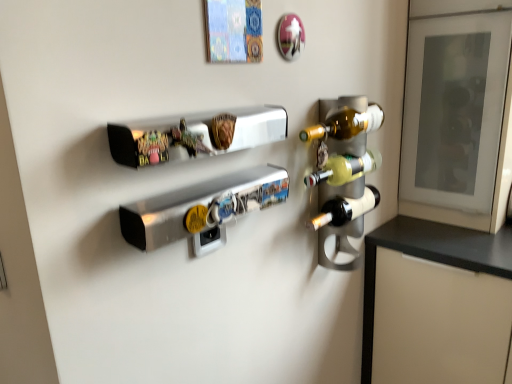
Question: Does brushed metal snowboard at center contain matte black wine bottle at right, placed as the 1th bottle when sorted from bottom to top?

Choices:
 (A) no
 (B) yes

Answer: (A)

Question: Is brushed metal snowboard at center at the left side of matte black wine bottle at right, marked as the 2th bottle in a top-to-bottom arrangement?

Choices:
 (A) yes
 (B) no

Answer: (A)

Question: Is matte black wine bottle at right, placed as the 1th bottle when sorted from bottom to top, at the back of brushed metal snowboard at center?

Choices:
 (A) no
 (B) yes

Answer: (A)

Question: Is brushed metal snowboard at center in front of matte black wine bottle at right, placed as the 1th bottle when sorted from bottom to top?

Choices:
 (A) no
 (B) yes

Answer: (B)

Question: From a real-world perspective, is brushed metal snowboard at center physically below matte black wine bottle at right, placed as the 1th bottle when sorted from bottom to top?

Choices:
 (A) yes
 (B) no

Answer: (B)

Question: Is brushed metal snowboard at center oriented towards matte black wine bottle at right, marked as the 2th bottle in a top-to-bottom arrangement?

Choices:
 (A) no
 (B) yes

Answer: (A)

Question: Is matte black wine bottle at right, marked as the 2th bottle in a top-to-bottom arrangement, bigger than transparent glass door at upper right?

Choices:
 (A) yes
 (B) no

Answer: (B)

Question: Does matte black wine bottle at right, marked as the 2th bottle in a top-to-bottom arrangement, lie in front of transparent glass door at upper right?

Choices:
 (A) yes
 (B) no

Answer: (A)

Question: Can you confirm if matte black wine bottle at right, marked as the 2th bottle in a top-to-bottom arrangement, is taller than transparent glass door at upper right?

Choices:
 (A) no
 (B) yes

Answer: (A)

Question: From the image's perspective, is matte black wine bottle at right, marked as the 2th bottle in a top-to-bottom arrangement, beneath transparent glass door at upper right?

Choices:
 (A) no
 (B) yes

Answer: (B)

Question: Can you confirm if matte black wine bottle at right, marked as the 2th bottle in a top-to-bottom arrangement, is positioned to the left of transparent glass door at upper right?

Choices:
 (A) no
 (B) yes

Answer: (B)

Question: Is transparent glass door at upper right located within matte black wine bottle at right, placed as the 1th bottle when sorted from bottom to top?

Choices:
 (A) yes
 (B) no

Answer: (B)

Question: Would you say transparent glass door at upper right is outside translucent glass wine bottle at right, the second bottle ordered from the bottom?

Choices:
 (A) yes
 (B) no

Answer: (A)